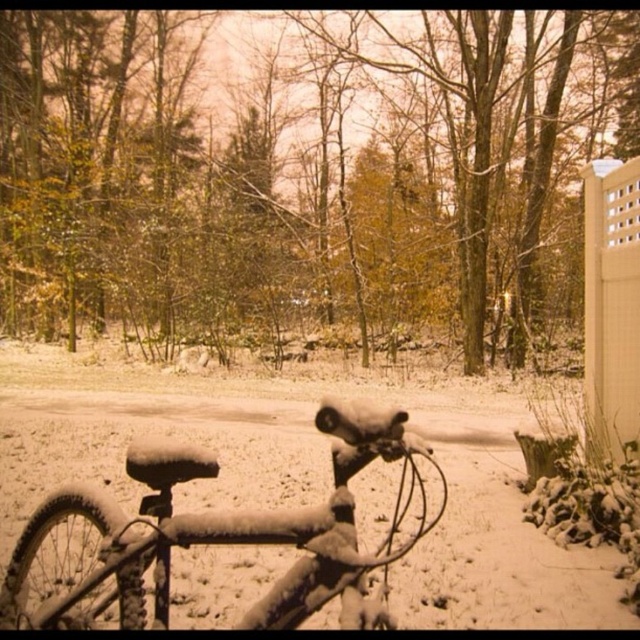
From the picture: Can you confirm if slightly frosty matte metal mountain bike at lower left is positioned below white lattice fence at right?

Yes, slightly frosty matte metal mountain bike at lower left is below white lattice fence at right.

Who is taller, slightly frosty matte metal mountain bike at lower left or white lattice fence at right?

With more height is slightly frosty matte metal mountain bike at lower left.

The width and height of the screenshot is (640, 640). Find the location of `slightly frosty matte metal mountain bike at lower left`. slightly frosty matte metal mountain bike at lower left is located at coordinates (228, 532).